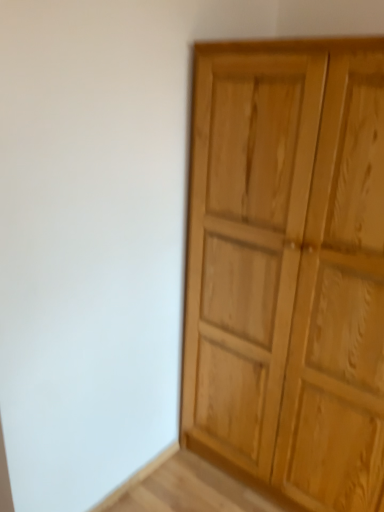
What do you see at coordinates (288, 268) in the screenshot? Image resolution: width=384 pixels, height=512 pixels. I see `natural wood cupboard at right` at bounding box center [288, 268].

Where is `natural wood cupboard at right`? natural wood cupboard at right is located at coordinates [x=288, y=268].

Find the location of a particular element. natural wood cupboard at right is located at coordinates [288, 268].